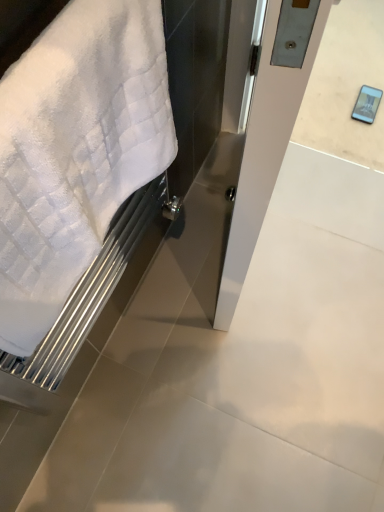
Locate an element on the screen. vacant space positioned to the left of satin silver door at center is located at coordinates (180, 242).